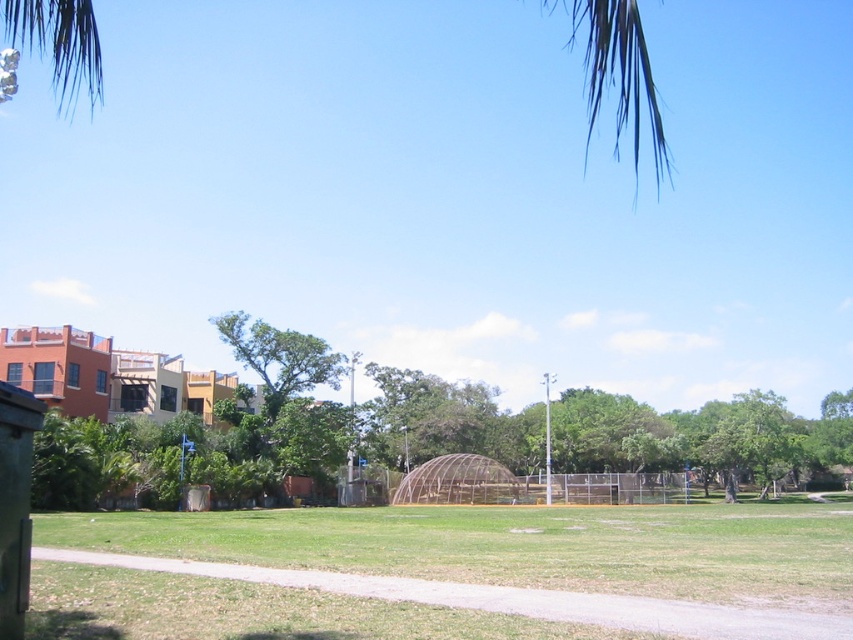
Is green grass at center further to the viewer compared to green leafy palm tree at upper left?

Yes, it is behind green leafy palm tree at upper left.

Can you confirm if green grass at center is bigger than green leafy palm tree at upper left?

No.

Locate an element on the screen. green grass at center is located at coordinates (433, 566).

You are a GUI agent. You are given a task and a screenshot of the screen. Output one action in this format:
    pyautogui.click(x=<x>, y=<y>)
    Task: Click on the green grass at center
    
    Given the screenshot: What is the action you would take?
    coord(433,566)